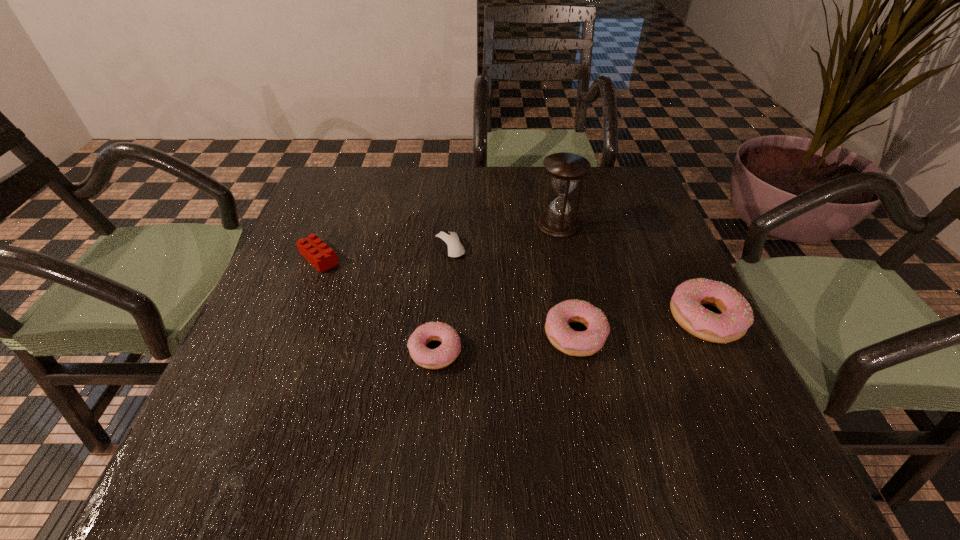
Image resolution: width=960 pixels, height=540 pixels. Identify the location of object that is the fourth closest to the rightmost object. (450, 242).

Select which object is the fifth closest to the leftmost doughnut. Please provide its 2D coordinates. Your answer should be formatted as a tuple, i.e. [(x, y)], where the tuple contains the x and y coordinates of a point satisfying the conditions above.

[(686, 304)]

Identify which doughnut is located as the second nearest to the third tallest object. Please provide its 2D coordinates. Your answer should be formatted as a tuple, i.e. [(x, y)], where the tuple contains the x and y coordinates of a point satisfying the conditions above.

[(442, 356)]

Image resolution: width=960 pixels, height=540 pixels. I want to click on doughnut that is the second closest to the mouse, so click(575, 343).

What are the coordinates of `vacant space that satisfies the following two spatial constraints: 1. on the front side of the mouse; 2. on the right side of the tallest doughnut` in the screenshot? It's located at (444, 318).

The width and height of the screenshot is (960, 540). I want to click on vacant region that satisfies the following two spatial constraints: 1. on the front side of the leftmost object; 2. on the right side of the leftmost doughnut, so click(x=282, y=350).

The height and width of the screenshot is (540, 960). I want to click on free location that satisfies the following two spatial constraints: 1. on the front side of the leftmost doughnut; 2. on the left side of the Lego, so click(282, 350).